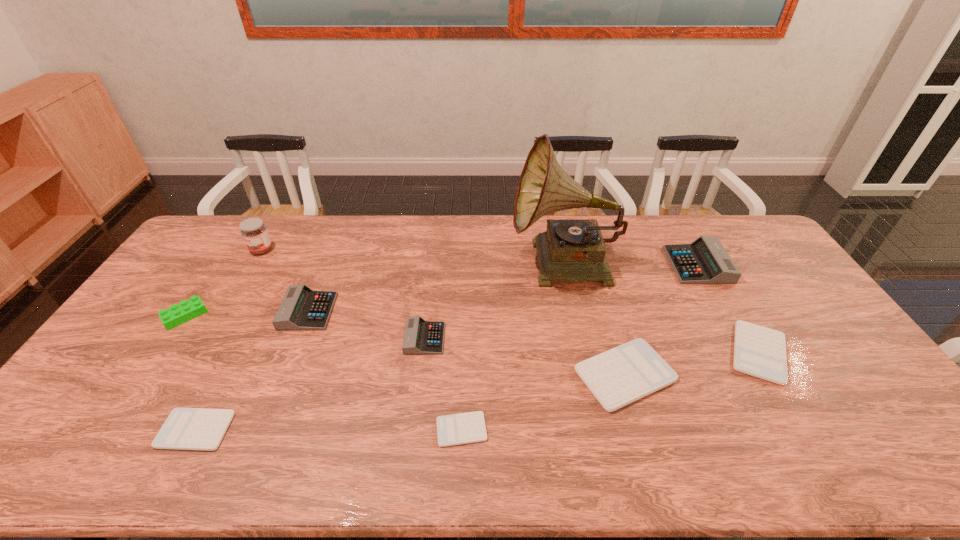
Locate an element on the screen. The width and height of the screenshot is (960, 540). vacant space located 0.340m on the right of the shortest object is located at coordinates (628, 429).

Image resolution: width=960 pixels, height=540 pixels. Find the location of `record player at the far edge`. record player at the far edge is located at coordinates (574, 250).

Where is `jam that is at the far edge`? This screenshot has width=960, height=540. jam that is at the far edge is located at coordinates (254, 232).

The image size is (960, 540). In order to click on calculator at the far edge in this screenshot , I will do `click(705, 261)`.

I want to click on object positioned at the left edge, so (x=176, y=315).

In the image, there is a desktop. At what (x,y) coordinates should I click in order to perform the action: click on vacant space at the far edge. Please return your answer as a coordinate pair (x, y). Looking at the image, I should click on (258, 215).

This screenshot has height=540, width=960. In order to click on free space at the left edge of the desktop in this screenshot , I will do `click(95, 404)`.

In the image, there is a desktop. Identify the location of blank space at the right edge. The height and width of the screenshot is (540, 960). (814, 318).

The width and height of the screenshot is (960, 540). In the image, there is a desktop. In order to click on vacant space at the near left corner in this screenshot , I will do `click(66, 467)`.

The width and height of the screenshot is (960, 540). In the image, there is a desktop. Find the location of `vacant space at the far right corner`. vacant space at the far right corner is located at coordinates (742, 235).